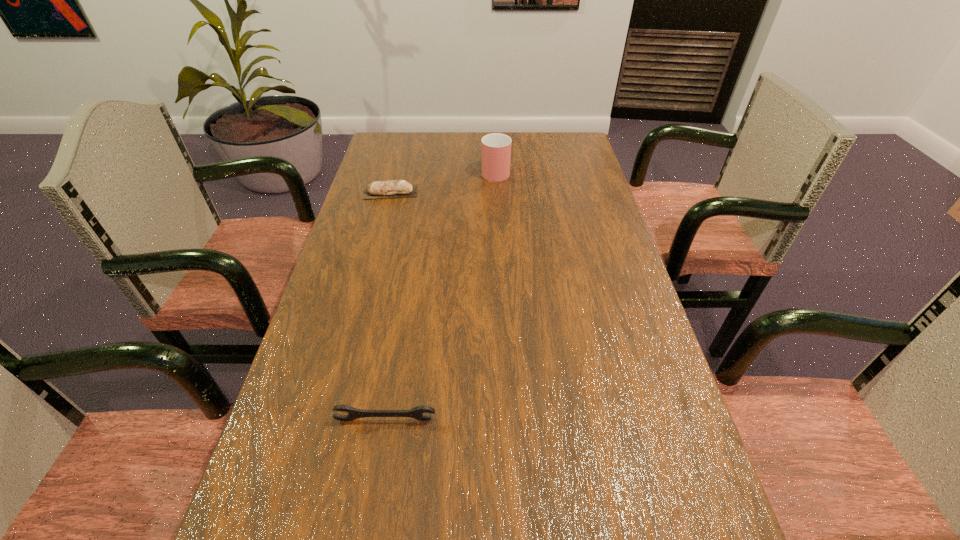
You are a GUI agent. You are given a task and a screenshot of the screen. Output one action in this format:
    pyautogui.click(x=<x>, y=<y>)
    Task: Click on the object present at the far edge
    The width and height of the screenshot is (960, 540).
    Given the screenshot: What is the action you would take?
    pyautogui.click(x=496, y=148)

Identify the location of wrench located at the left edge. This screenshot has width=960, height=540. (417, 412).

Locate an element on the screen. pita bread that is at the left edge is located at coordinates (391, 188).

Find the location of `blank space at the far edge of the desktop`. blank space at the far edge of the desktop is located at coordinates point(426,154).

Where is `vacant space at the left edge`? The image size is (960, 540). vacant space at the left edge is located at coordinates (371, 225).

Find the location of a particular element. free region at the right edge is located at coordinates (572, 172).

You are a GUI agent. You are given a task and a screenshot of the screen. Output one action in this format:
    pyautogui.click(x=<x>, y=<y>)
    Task: Click on the free space at the far left corner of the desktop
    
    Given the screenshot: What is the action you would take?
    pyautogui.click(x=404, y=137)

In the image, there is a desktop. In order to click on vacant space at the far right corner in this screenshot , I will do `click(570, 157)`.

In order to click on free spot between the rightmost object and the second farthest object in this screenshot , I will do `click(443, 181)`.

Where is `empty location between the farthest object and the wrench`? The height and width of the screenshot is (540, 960). empty location between the farthest object and the wrench is located at coordinates coord(441,295).